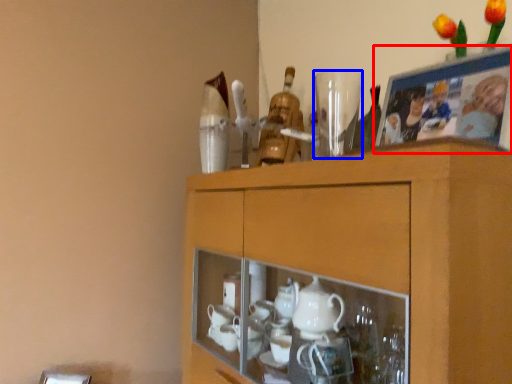
Question: Among these objects, which one is nearest to the camera, picture frame (highlighted by a red box) or tableware (highlighted by a blue box)?

Choices:
 (A) picture frame
 (B) tableware

Answer: (A)